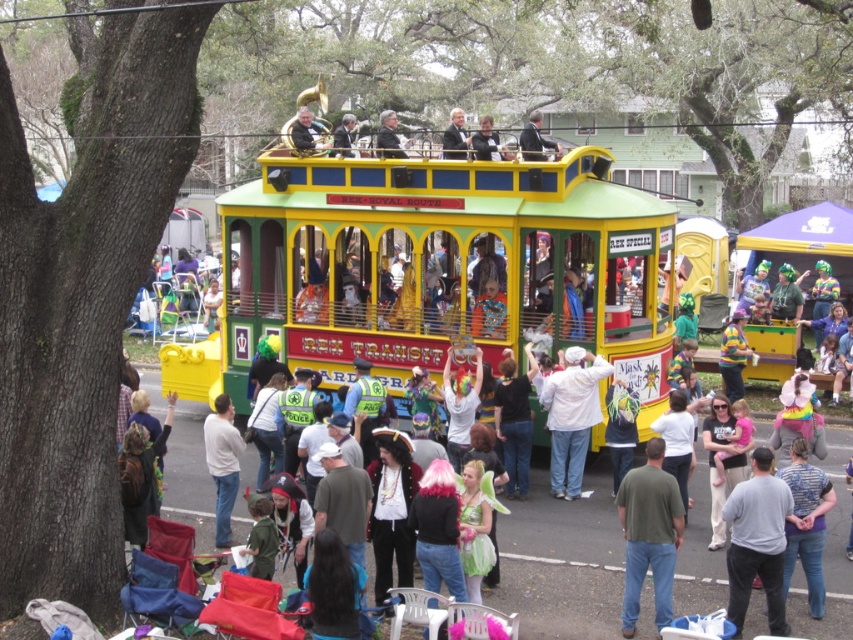
Question: Does blue striped shirt at center appear on the right side of smooth gray suit at upper center?

Choices:
 (A) no
 (B) yes

Answer: (B)

Question: Does blue striped shirt at center have a larger size compared to dark gray suit at upper center?

Choices:
 (A) yes
 (B) no

Answer: (B)

Question: Which of the following is the closest to the observer?

Choices:
 (A) (537, 156)
 (B) (294, 124)

Answer: (A)

Question: Among these objects, which one is nearest to the camera?

Choices:
 (A) white matte shirt at lower left
 (B) blue striped shirt at center
 (C) white matte shirt at center
 (D) matte black jacket at upper center

Answer: (B)

Question: Can you confirm if blue striped shirt at center is positioned above matte black jacket at upper center?

Choices:
 (A) no
 (B) yes

Answer: (A)

Question: Which object appears farthest from the camera in this image?

Choices:
 (A) matte black jacket at upper center
 (B) white matte shirt at lower left
 (C) shiny black suit at upper center
 (D) green matte shirt at center

Answer: (C)